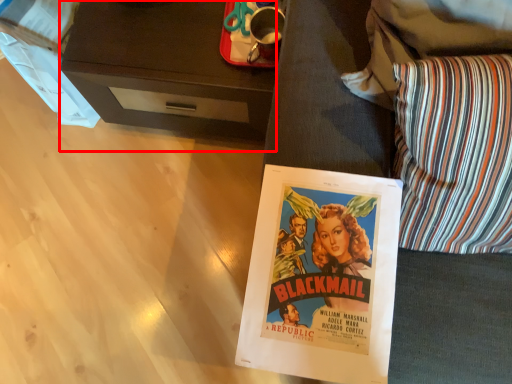
Question: Observing the image, what is the correct spatial positioning of desk (annotated by the red box) in reference to throw pillow?

Choices:
 (A) right
 (B) left

Answer: (B)